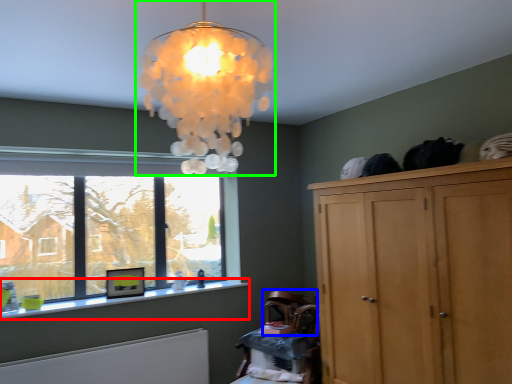
Question: Estimate the real-world distances between objects in this image. Which object is farther from window sill (highlighted by a red box), armchair (highlighted by a blue box) or lamp (highlighted by a green box)?

Choices:
 (A) armchair
 (B) lamp

Answer: (B)